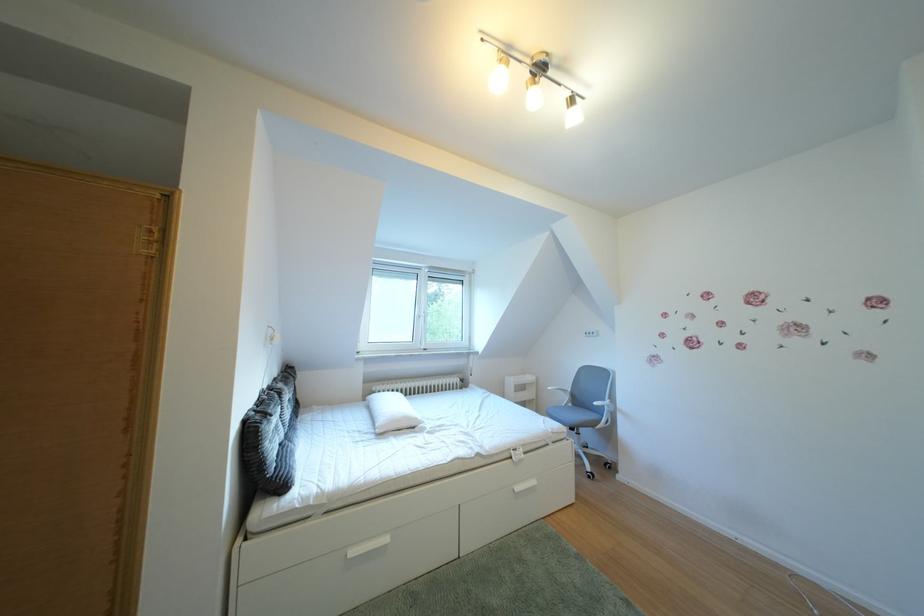
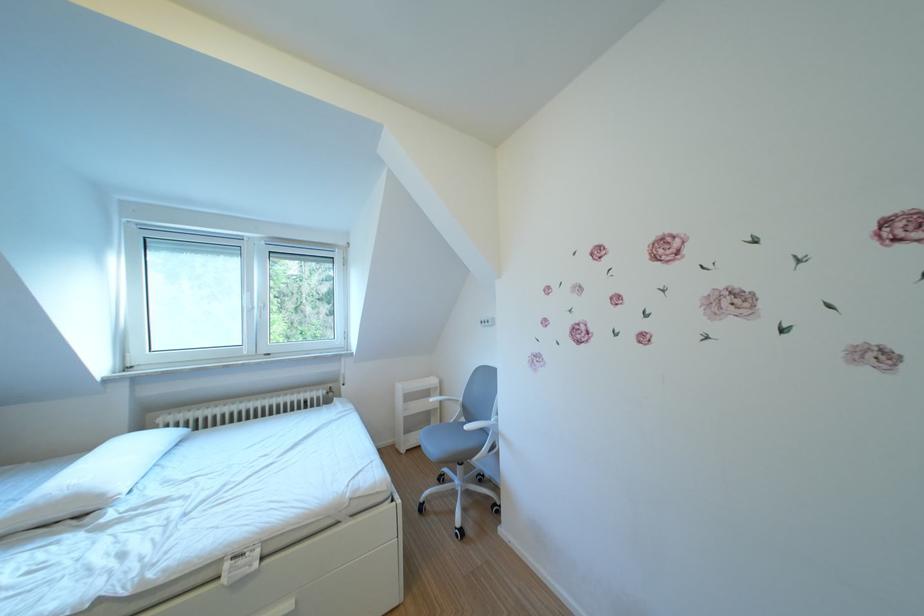
The point at (584, 410) is marked in the first image. Where is the corresponding point in the second image?

(477, 424)